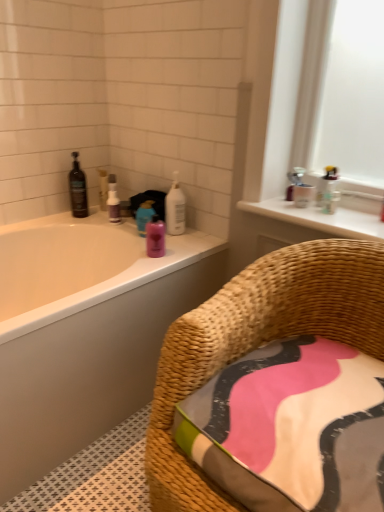
This screenshot has height=512, width=384. What are the coordinates of `free area in between purple matte spray bottle at upper left, which ranks as the 1th cleaning product in left-to-right order, and black glass bottle at upper left` in the screenshot? It's located at (96, 221).